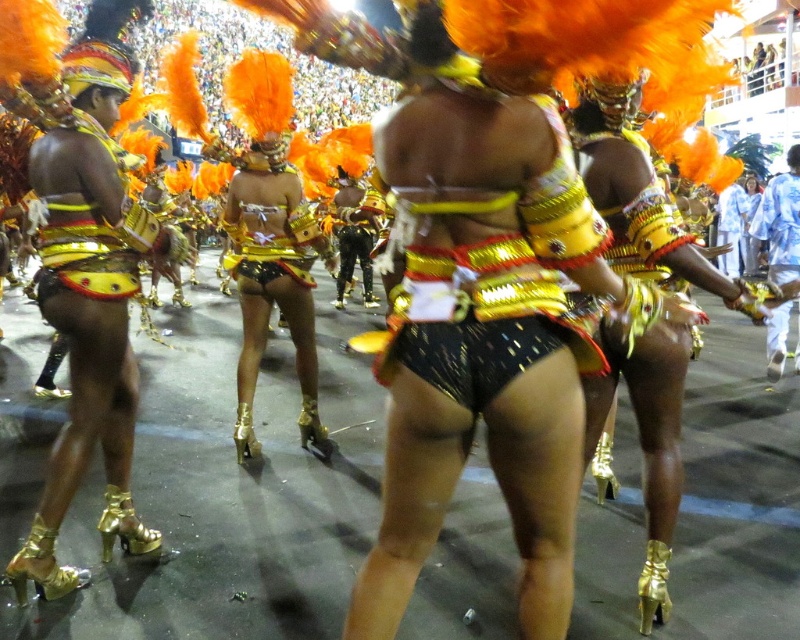
You are a photographer aiming to capture a closeup shot of the blue fabric pants at right and the blue cotton shirt at right. Which object should you zoom in on to ensure the subject fills the frame without distortion?

The blue fabric pants at right might be wider than blue cotton shirt at right, so you should zoom in on the blue cotton shirt at right to avoid distortion since it is narrower.

You are standing at the edge of the carnival parade watching the performers. There is a point at coordinate (90, 307) in the image. What object is located at that point?

The point at coordinate (90, 307) corresponds to shiny gold shorts at center.

You are a photographer trying to capture the performers in the carnival scene. You notice two items of clothing that stand out. The shiny black pants at center and the blue cotton shirt at right. Which clothing item is positioned to the left of the other?

The shiny black pants at center are to the left of the blue cotton shirt at right.